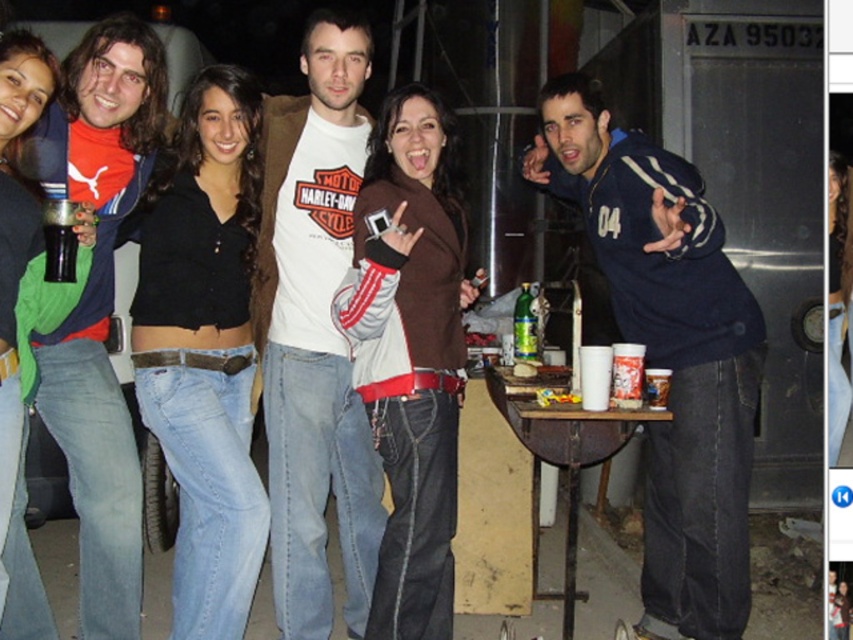
Question: Where is matte blue jacket at left located in relation to black plastic cup at left in the image?

Choices:
 (A) below
 (B) above

Answer: (A)

Question: Is black cotton top at center positioned behind green glass bottle at center?

Choices:
 (A) no
 (B) yes

Answer: (A)

Question: Is white cotton t-shirt at center thinner than brown suede jacket at center?

Choices:
 (A) yes
 (B) no

Answer: (A)

Question: Which point is closer to the camera taking this photo?

Choices:
 (A) (474, 275)
 (B) (73, 250)
 (C) (126, 49)

Answer: (B)

Question: Among these points, which one is nearest to the camera?

Choices:
 (A) (61, 99)
 (B) (519, 305)
 (C) (248, 372)
 (D) (61, 252)

Answer: (D)

Question: Which object is the farthest from the black cotton top at center?

Choices:
 (A) green glass bottle at center
 (B) blue fleece jacket at center
 (C) black plastic cup at left
 (D) brown suede jacket at center

Answer: (B)